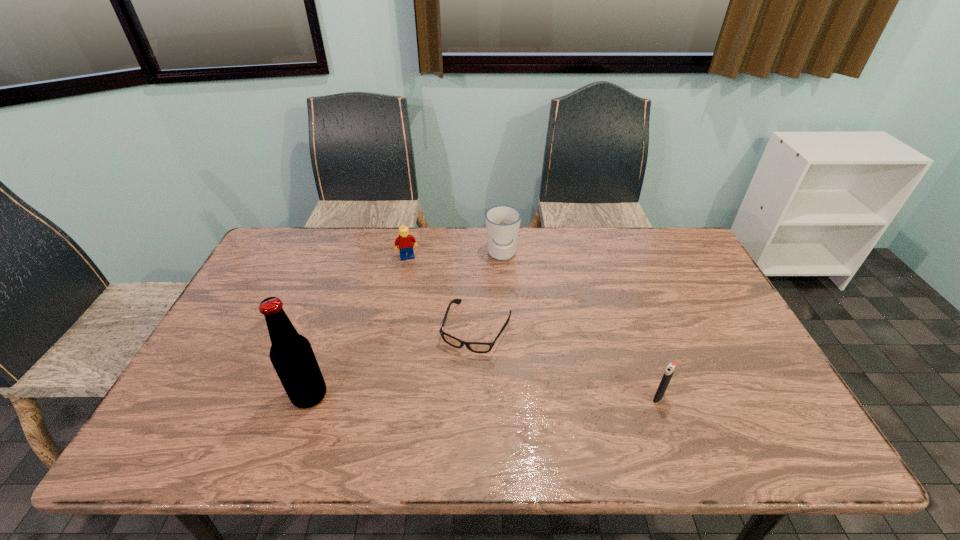
Image resolution: width=960 pixels, height=540 pixels. What are the coordinates of `igniter that is at the near edge` in the screenshot? It's located at (671, 367).

This screenshot has height=540, width=960. In the image, there is a desktop. What are the coordinates of `free region at the far edge` in the screenshot? It's located at (359, 245).

In order to click on vacant space at the near edge of the desktop in this screenshot , I will do [x=677, y=404].

Identify the location of vacant space at the right edge. point(699,282).

This screenshot has width=960, height=540. In the image, there is a desktop. Identify the location of vacant space at the far left corner. (307, 252).

In the image, there is a desktop. Identify the location of vacant space at the far right corner. This screenshot has height=540, width=960. (697, 258).

This screenshot has height=540, width=960. I want to click on vacant region at the near right corner, so click(x=738, y=419).

Where is `free space between the beer bottle and the cup`? The width and height of the screenshot is (960, 540). free space between the beer bottle and the cup is located at coordinates (405, 325).

Image resolution: width=960 pixels, height=540 pixels. In order to click on vacant area between the cup and the rightmost object in this screenshot , I will do `click(580, 326)`.

Locate an element on the screen. empty location between the fourth object from right to left and the cup is located at coordinates (455, 256).